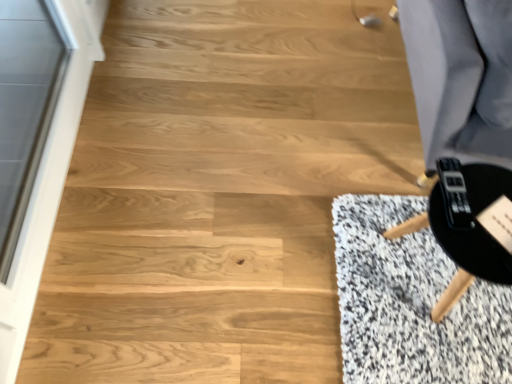
This screenshot has width=512, height=384. Find the location of `vacant area that is situated to the right of transparent glass screen door at left`. vacant area that is situated to the right of transparent glass screen door at left is located at coordinates (224, 199).